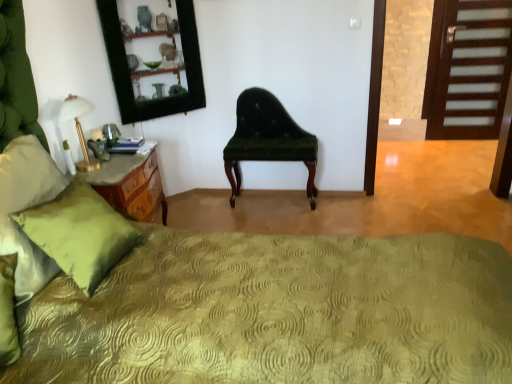
Question: Is green glass mirror at upper left next to velvet green chair at center and touching it?

Choices:
 (A) no
 (B) yes

Answer: (A)

Question: From a real-world perspective, is green glass mirror at upper left on velvet green chair at center?

Choices:
 (A) no
 (B) yes

Answer: (B)

Question: Is green glass mirror at upper left looking in the opposite direction of velvet green chair at center?

Choices:
 (A) no
 (B) yes

Answer: (A)

Question: Does green glass mirror at upper left contain velvet green chair at center?

Choices:
 (A) yes
 (B) no

Answer: (B)

Question: Does green glass mirror at upper left have a larger size compared to velvet green chair at center?

Choices:
 (A) no
 (B) yes

Answer: (A)

Question: Does green glass mirror at upper left turn towards velvet green chair at center?

Choices:
 (A) no
 (B) yes

Answer: (A)

Question: Does white glass table lamp at left lie behind velvet green chair at center?

Choices:
 (A) no
 (B) yes

Answer: (A)

Question: From the image's perspective, is white glass table lamp at left located beneath velvet green chair at center?

Choices:
 (A) yes
 (B) no

Answer: (B)

Question: Considering the relative sizes of white glass table lamp at left and velvet green chair at center in the image provided, is white glass table lamp at left smaller than velvet green chair at center?

Choices:
 (A) yes
 (B) no

Answer: (A)

Question: Is velvet green chair at center a part of white glass table lamp at left?

Choices:
 (A) no
 (B) yes

Answer: (A)

Question: Does white glass table lamp at left appear on the right side of velvet green chair at center?

Choices:
 (A) yes
 (B) no

Answer: (B)

Question: Is white glass table lamp at left thinner than velvet green chair at center?

Choices:
 (A) no
 (B) yes

Answer: (B)

Question: Can you see velvet green chair at center touching dark wood door at right?

Choices:
 (A) no
 (B) yes

Answer: (A)